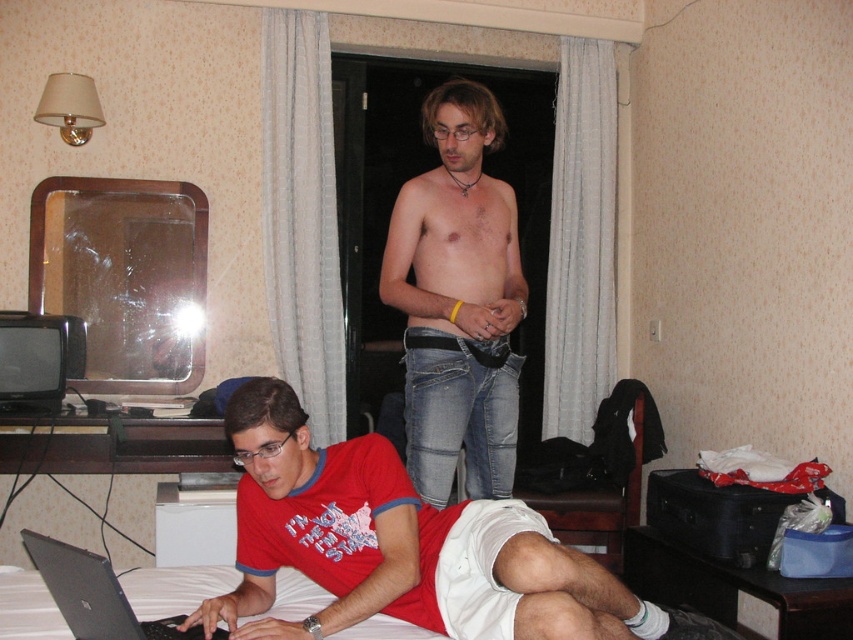
You are standing in the hotel room and want to place a small plant exactly at point (386, 442). Considering the distance from where you are standing to that point is 6.21 feet, can you reach there without moving your feet?

The distance of point (386, 442) from camera is 6.21 feet, so if you are standing at the camera position, you cannot reach the point without moving your feet since it is 6.21 feet away.